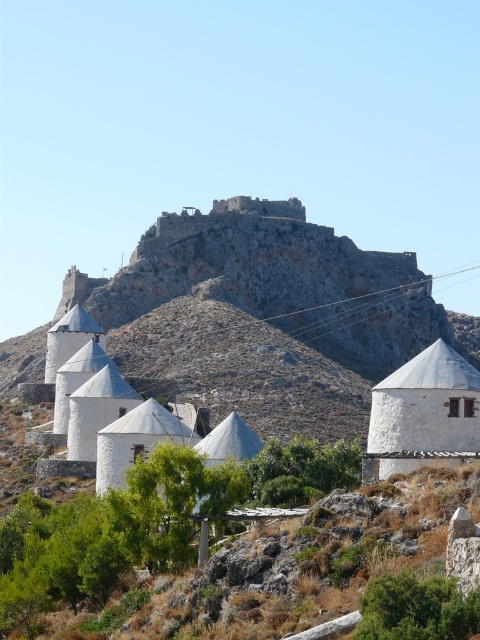
Who is more forward, (324, 339) or (453, 353)?

Point (453, 353)

Is point (180, 237) positioned behind point (430, 428)?

Yes, point (180, 237) is behind point (430, 428).

The image size is (480, 640). I want to click on rustic stone castle at upper center, so click(255, 317).